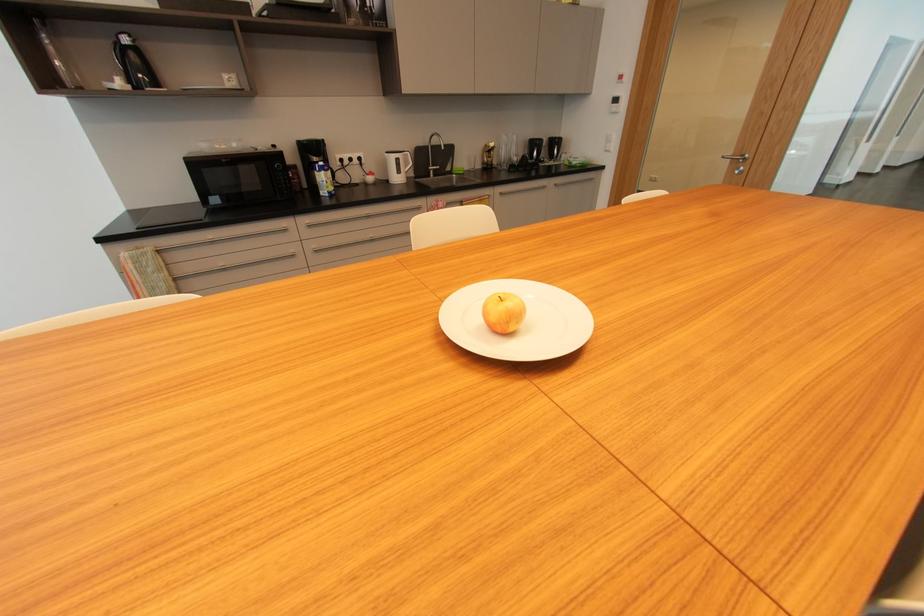
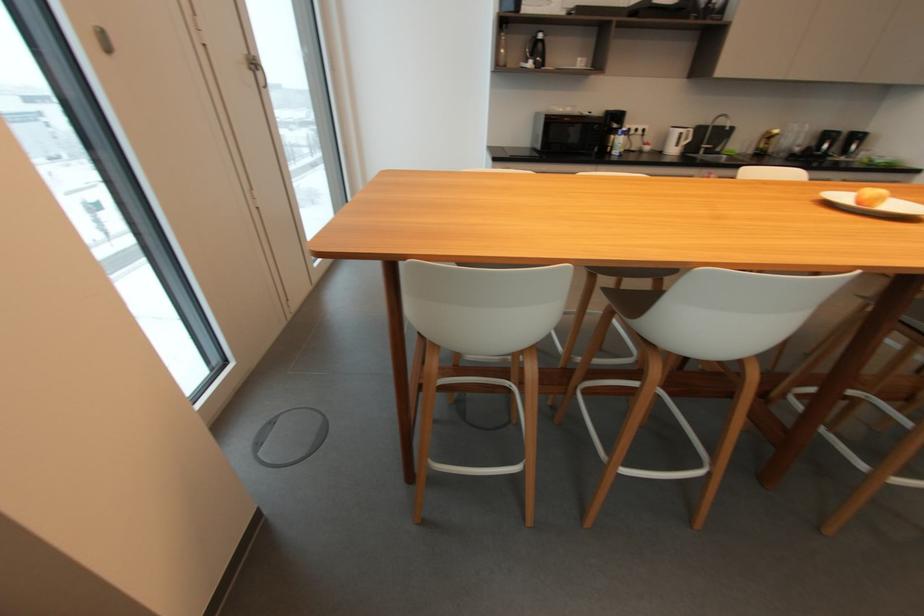
Find the pixel in the second image that matches [400,160] in the first image.

(685, 134)